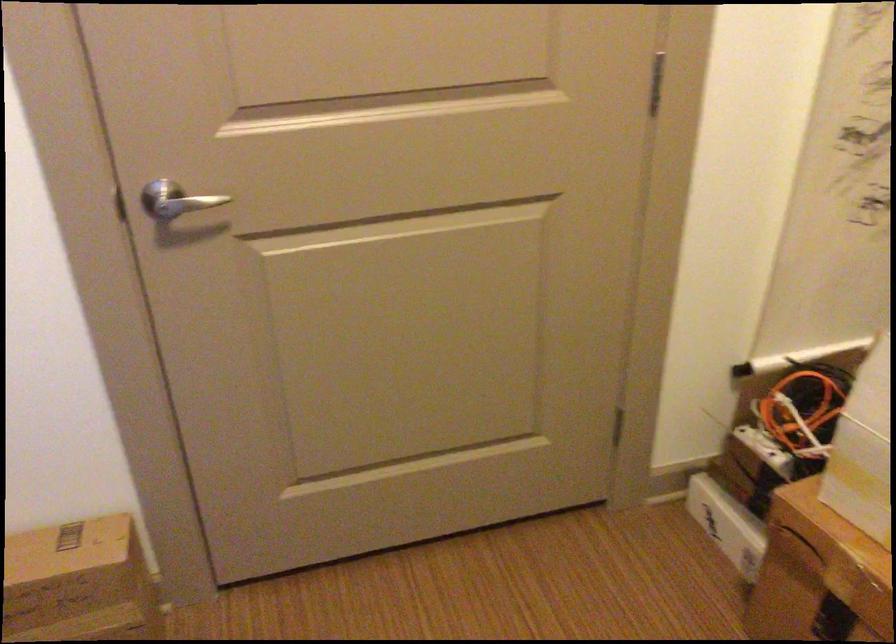
Identify the location of orange cable. The width and height of the screenshot is (896, 644). (803, 408).